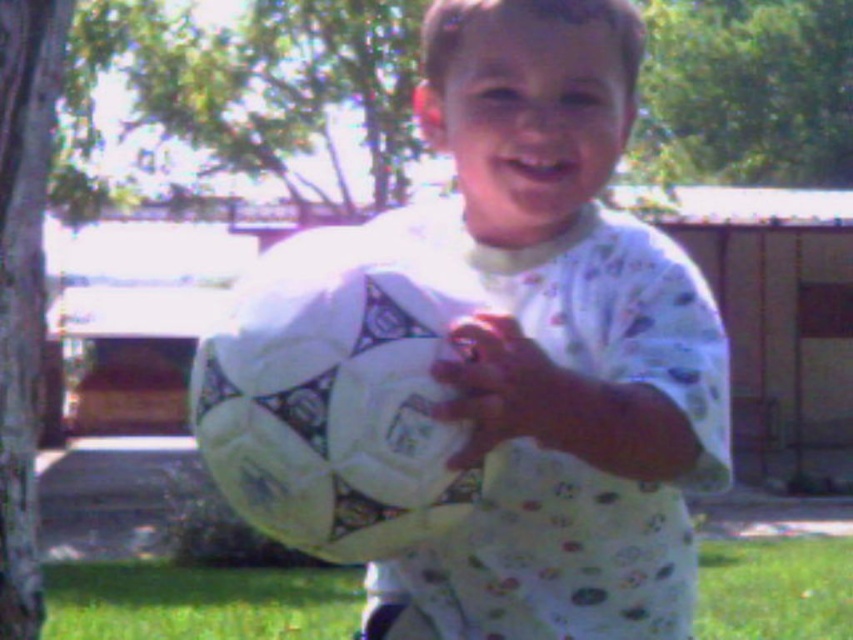
Question: Can you confirm if green grass at lower center is positioned to the right of smooth white glove at center?

Choices:
 (A) yes
 (B) no

Answer: (B)

Question: Is green grass at lower center above smooth white glove at center?

Choices:
 (A) no
 (B) yes

Answer: (A)

Question: Which of the following is the farthest from the observer?

Choices:
 (A) (515, 358)
 (B) (178, 618)
 (C) (569, 93)

Answer: (B)

Question: Where is white matte soccer ball at center located in relation to smooth white glove at center in the image?

Choices:
 (A) above
 (B) below

Answer: (A)

Question: Which object appears closest to the camera in this image?

Choices:
 (A) white matte soccer ball at center
 (B) smooth white glove at center

Answer: (A)

Question: Which point is farther to the camera?

Choices:
 (A) smooth white glove at center
 (B) white matte soccer ball at center

Answer: (A)